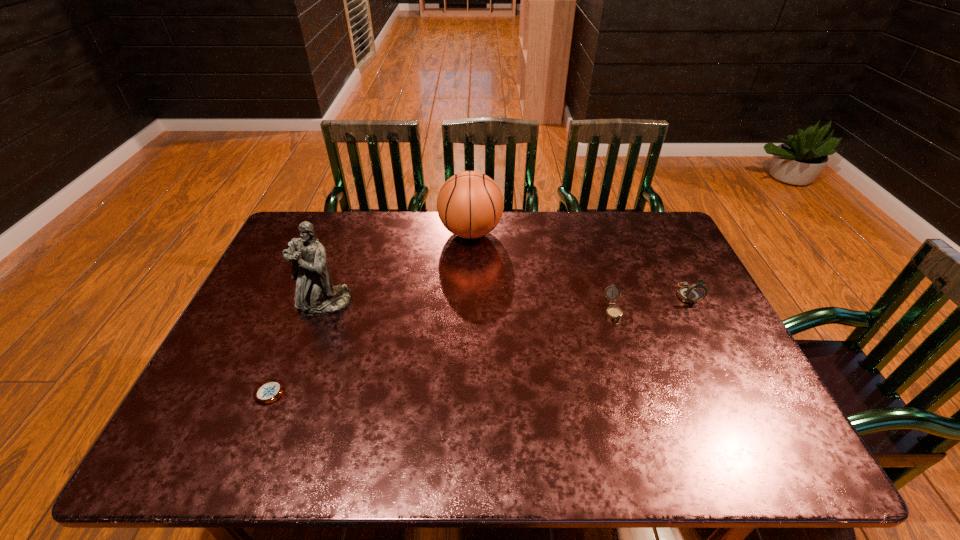
At what (x,y) coordinates should I click in order to perform the action: click on vacant space at the left edge of the desktop. Please return your answer as a coordinate pair (x, y). The height and width of the screenshot is (540, 960). Looking at the image, I should click on (262, 300).

Where is `blank area at the right edge`? blank area at the right edge is located at coordinates (720, 344).

The image size is (960, 540). In order to click on blank space at the near left corner of the desktop in this screenshot , I will do `click(173, 447)`.

The image size is (960, 540). What are the coordinates of `empty space between the farthest object and the second shortest object` in the screenshot? It's located at (542, 272).

The image size is (960, 540). I want to click on free space between the tallest object and the rightmost object, so click(506, 299).

Where is `vacant region between the fourth object from left to right and the leftmost compass`? The width and height of the screenshot is (960, 540). vacant region between the fourth object from left to right and the leftmost compass is located at coordinates (441, 353).

This screenshot has height=540, width=960. In order to click on free point between the farthest object and the rightmost compass in this screenshot , I will do `click(579, 264)`.

You are a GUI agent. You are given a task and a screenshot of the screen. Output one action in this format:
    pyautogui.click(x=<x>, y=<y>)
    Task: Click on the free spot between the tallest object and the second shortest object
    The height and width of the screenshot is (540, 960).
    Given the screenshot: What is the action you would take?
    pyautogui.click(x=468, y=308)

I want to click on free spot between the rightmost compass and the shortest object, so pyautogui.click(x=478, y=343).

Locate an element on the screen. The width and height of the screenshot is (960, 540). free spot between the tallest compass and the second object from right to left is located at coordinates (650, 303).